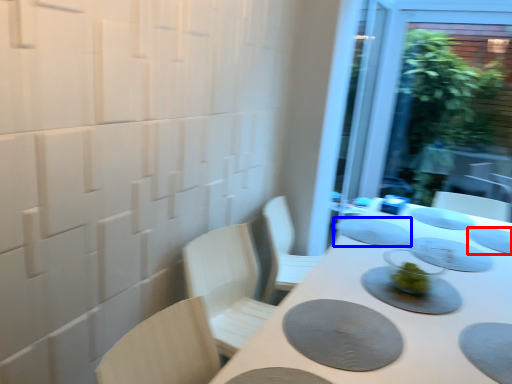
Question: Which object is further to the camera taking this photo, tableware (highlighted by a red box) or tableware (highlighted by a blue box)?

Choices:
 (A) tableware
 (B) tableware

Answer: (B)